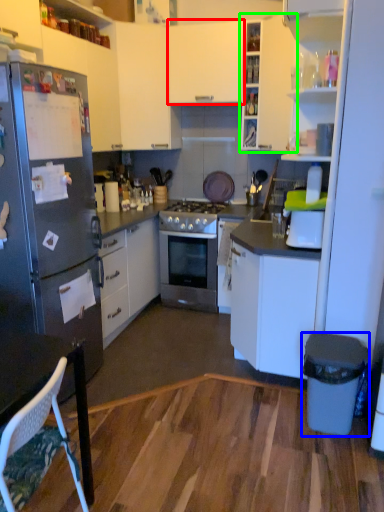
Question: Which object is the farthest from cabinetry (highlighted by a red box)? Choose among these: trash bin/can (highlighted by a blue box) or cabinetry (highlighted by a green box).

Choices:
 (A) trash bin/can
 (B) cabinetry

Answer: (A)